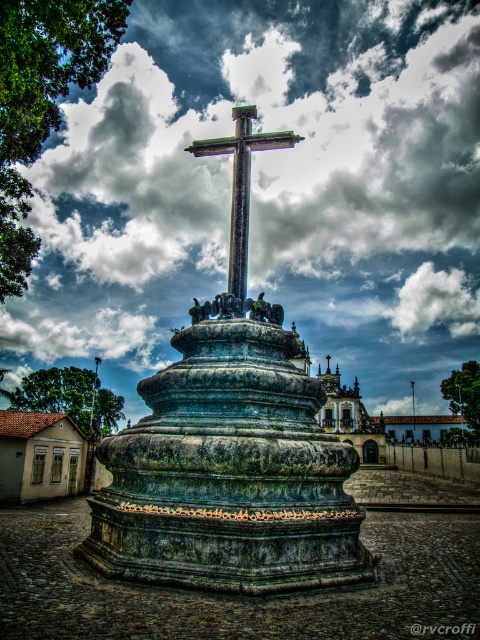
Question: In this image, where is cloudy sky at upper center located relative to green stone cross at center?

Choices:
 (A) right
 (B) left

Answer: (A)

Question: Is cloudy sky at upper center in front of green stone cross at center?

Choices:
 (A) no
 (B) yes

Answer: (A)

Question: Which object is closer to the camera taking this photo?

Choices:
 (A) polished stone cross at center
 (B) cloudy sky at upper center

Answer: (A)

Question: Does green stone cross at center have a greater width compared to polished stone cross at center?

Choices:
 (A) no
 (B) yes

Answer: (B)

Question: Which object is the closest to the cloudy sky at upper center?

Choices:
 (A) green stone cross at center
 (B) polished stone cross at center

Answer: (A)

Question: Which point is farther to the camera?

Choices:
 (A) polished stone cross at center
 (B) green stone cross at center
 (C) cloudy sky at upper center

Answer: (C)